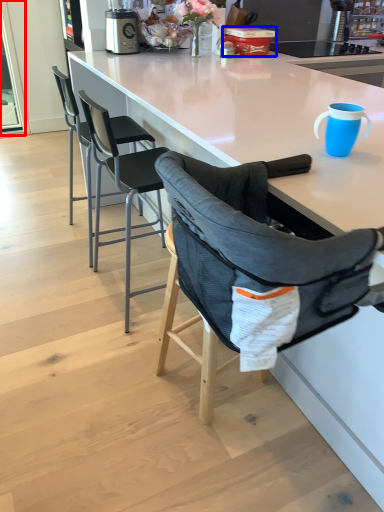
Question: Among these objects, which one is nearest to the camera, screen door (highlighted by a red box) or appliance (highlighted by a blue box)?

Choices:
 (A) screen door
 (B) appliance

Answer: (B)